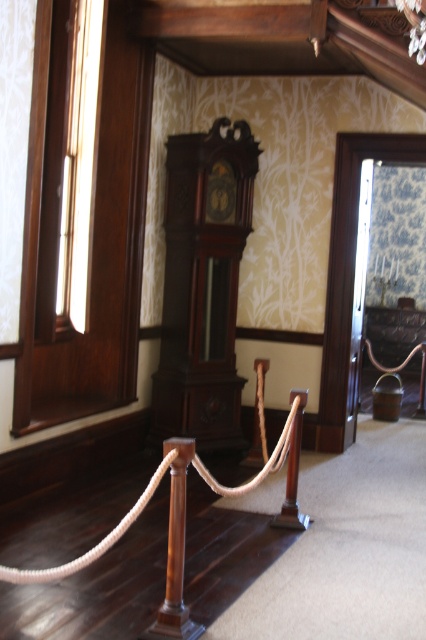
Does dark wood grandfather clock at center lie in front of brown rope at center?

No, it is behind brown rope at center.

Who is positioned more to the right, dark wood grandfather clock at center or brown rope at center?

dark wood grandfather clock at center

Which is in front, point (189, 136) or point (74, 566)?

Positioned in front is point (74, 566).

Identify the location of dark wood grandfather clock at center. (203, 284).